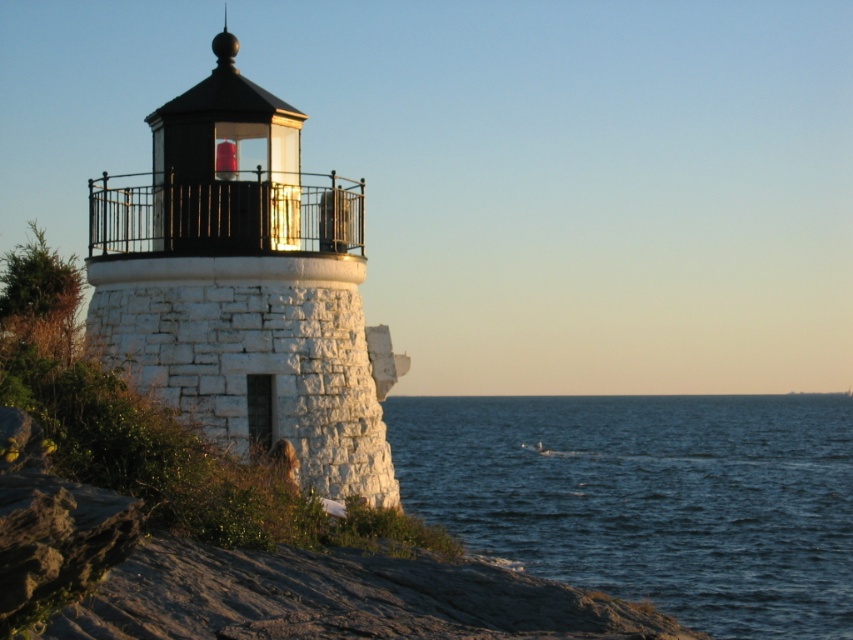
Measure the distance between point (590, 456) and camera.

Point (590, 456) and camera are 333.22 feet apart.

Which is above, blue water at lower right or white stone lighthouse at center?

Positioned higher is white stone lighthouse at center.

Is point (427, 509) more distant than point (364, 332)?

Yes, it is.

The image size is (853, 640). Identify the location of blue water at lower right. (648, 499).